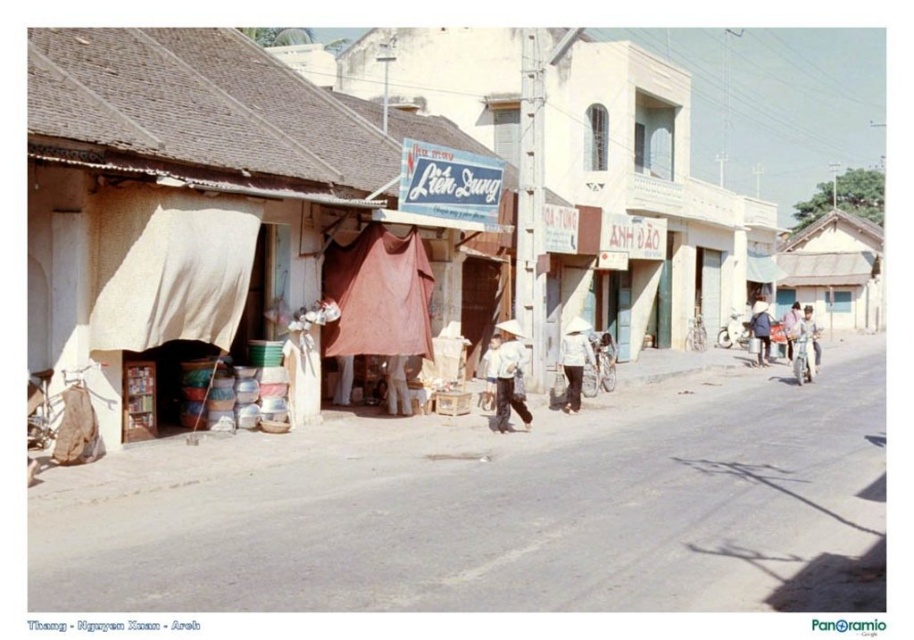
Question: Does matte white tent at center have a lesser width compared to light blue denim jacket at right?

Choices:
 (A) no
 (B) yes

Answer: (A)

Question: Which point is farther from the camera taking this photo?

Choices:
 (A) (390, 378)
 (B) (838, 256)
 (C) (480, 369)

Answer: (B)

Question: Estimate the real-world distances between objects in this image. Which object is closer to the wooden hut at right?

Choices:
 (A) matte white tent at center
 (B) wooden figure at center

Answer: (A)

Question: Is white fabric tent at center smaller than wooden hut at right?

Choices:
 (A) no
 (B) yes

Answer: (B)

Question: Is wooden figure at center smaller than dark blue fabric hat at center?

Choices:
 (A) no
 (B) yes

Answer: (B)

Question: Among these points, which one is nearest to the camera?

Choices:
 (A) (788, 339)
 (B) (575, 317)

Answer: (B)